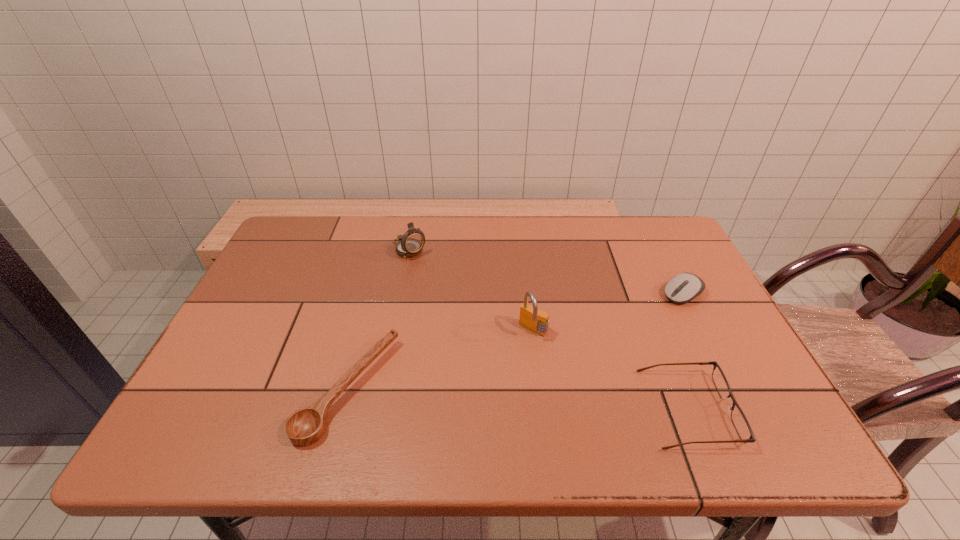
Identify the location of vacant space on the desktop that is between the wooden spoon and the spectacles and is positioned on the wheel side of the computer equipment. This screenshot has width=960, height=540. (523, 399).

What are the coordinates of `free spot on the desktop that is between the wooden spoon and the spectacles and is positioned on the face of the compass` in the screenshot? It's located at (561, 401).

The width and height of the screenshot is (960, 540). I want to click on free space on the desktop that is between the wooden spoon and the spectacles and is positioned on the side with the combination dials of the third object from left to right, so click(x=479, y=396).